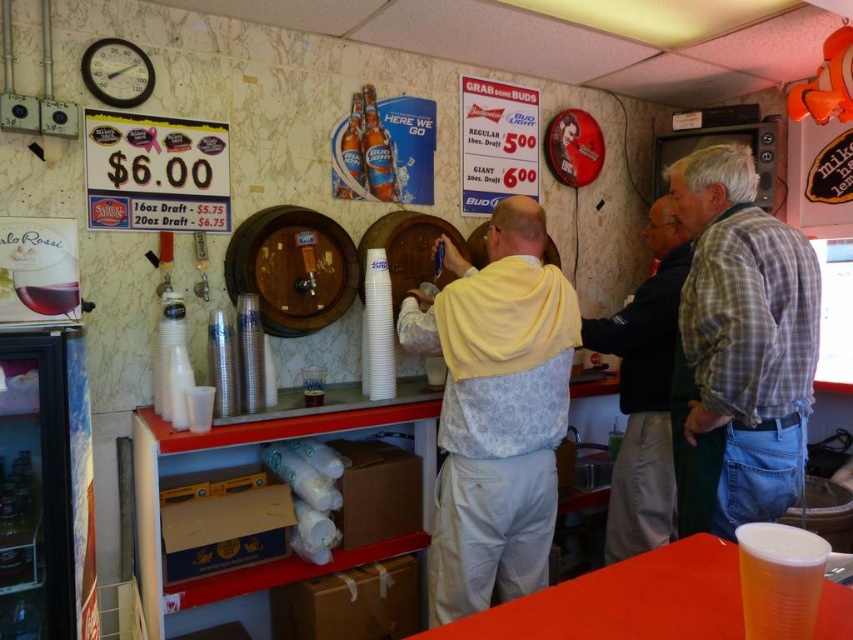
You are a customer at the bar and want to place your light yellow hoodie at center on top of the light yellow fabric at center. Will it fit vertically?

The light yellow fabric at center is taller than the light yellow hoodie at center, so yes, it will fit vertically.

You are a bartender who needs to reach the light yellow fabric at center to wipe it. Your arm can extend 2.5 meters. Can you reach it without moving?

The light yellow fabric at center is 6.30 feet away from the camera. Since 6.30 feet is approximately 1.92 meters, and your arm can extend 2.5 meters, you can reach it without moving.